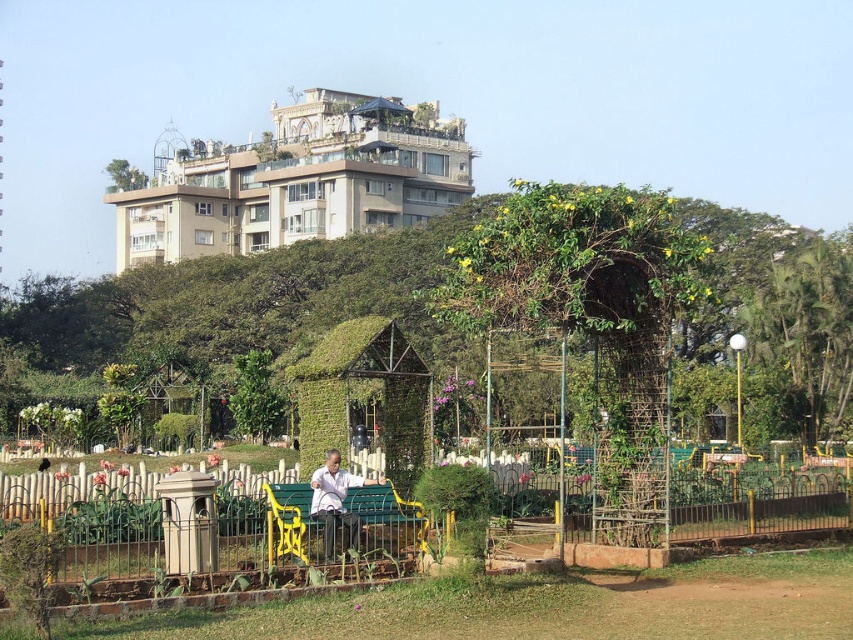
Question: Among these objects, which one is farthest from the camera?

Choices:
 (A) white fabric bench at center
 (B) green ivy-covered structure at center
 (C) green leafy tree at right
 (D) green painted wood bench at center

Answer: (C)

Question: Is green ivy-covered structure at center below green leafy tree at right?

Choices:
 (A) yes
 (B) no

Answer: (A)

Question: Considering the real-world distances, which object is closest to the white fabric bench at center?

Choices:
 (A) green leafy tree at right
 (B) green ivy-covered structure at center

Answer: (A)

Question: Considering the relative positions of green leafy tree at right and white fabric bench at center in the image provided, where is green leafy tree at right located with respect to white fabric bench at center?

Choices:
 (A) left
 (B) right

Answer: (B)

Question: Which point is farther to the camera?

Choices:
 (A) (833, 305)
 (B) (7, 419)
 (C) (341, 502)

Answer: (A)

Question: Does green leafy tree at center have a greater width compared to white fabric bench at center?

Choices:
 (A) yes
 (B) no

Answer: (A)